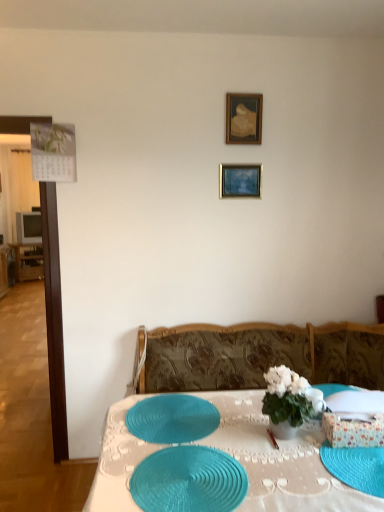
I want to click on free location above teal woven placemat at center, positioned as the second tableware in back-to-front order (from a real-world perspective), so click(x=191, y=470).